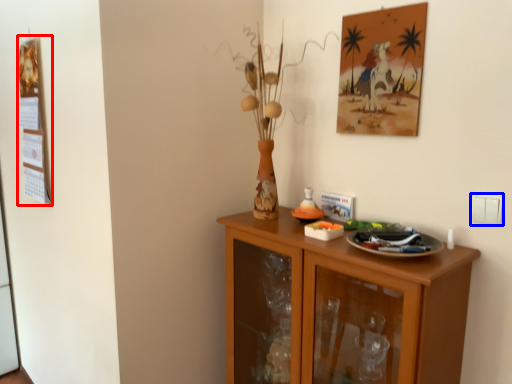
Question: Which object is further to the camera taking this photo, bulletin board (highlighted by a red box) or electric outlet (highlighted by a blue box)?

Choices:
 (A) bulletin board
 (B) electric outlet

Answer: (A)